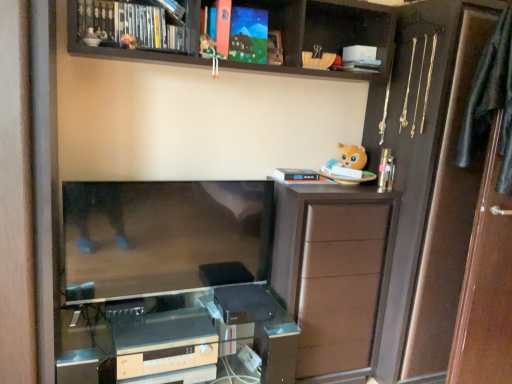
This screenshot has height=384, width=512. Describe the element at coordinates (166, 347) in the screenshot. I see `silver metallic stereo at lower center, positioned as the second appliance in right-to-left order` at that location.

In order to click on green felt bird at upper center, positioned as the second toy in left-to-right order in this screenshot , I will do `click(211, 53)`.

This screenshot has height=384, width=512. What do you see at coordinates (211, 53) in the screenshot?
I see `green felt bird at upper center, acting as the 1th toy starting from the right` at bounding box center [211, 53].

In order to click on silver/glass computer desk at lower center in this screenshot , I will do `click(181, 339)`.

Locate an element on the screen. The height and width of the screenshot is (384, 512). matte black bookshelf at upper center, which is the 1th book in left-to-right order is located at coordinates pos(128,26).

Image resolution: width=512 pixels, height=384 pixels. I want to click on black fabric robe at right, so click(x=490, y=100).

This screenshot has height=384, width=512. In order to click on white matte book at upper center, acting as the fifth book starting from the left in this screenshot , I will do `click(362, 66)`.

What do you see at coordinates (362, 66) in the screenshot?
I see `white matte book at upper center, marked as the 2th book in a bottom-to-top arrangement` at bounding box center [362, 66].

What do you see at coordinates (325, 33) in the screenshot?
I see `dark wood shelf at upper center` at bounding box center [325, 33].

I want to click on silver metallic stereo at lower center, the first appliance from the left, so [166, 347].

Which object is wider, transparent glass door at right or matte paper book at upper center, placed as the first book when sorted from top to bottom?

With larger width is transparent glass door at right.

Is transparent glass door at right at the left side of matte paper book at upper center, which is counted as the fourth book, starting from the right?

In fact, transparent glass door at right is to the right of matte paper book at upper center, which is counted as the fourth book, starting from the right.

Is transparent glass door at right oriented towards matte paper book at upper center, which is counted as the 5th book, starting from the bottom?

No, transparent glass door at right is not oriented towards matte paper book at upper center, which is counted as the 5th book, starting from the bottom.

Is green felt bird at upper center, acting as the 1th toy starting from the right, closer to the viewer compared to white matte book at upper center, the 4th book when ordered from left to right?

That is True.

In terms of width, does green felt bird at upper center, acting as the 1th toy starting from the right, look wider or thinner when compared to white matte book at upper center, the 4th book when ordered from left to right?

In the image, green felt bird at upper center, acting as the 1th toy starting from the right, appears to be more narrow than white matte book at upper center, the 4th book when ordered from left to right.

From a real-world perspective, is green felt bird at upper center, positioned as the second toy in left-to-right order, physically above white matte book at upper center, arranged as the first book when ordered from the bottom?

Yes.

Considering the sizes of green felt bird at upper center, positioned as the second toy in left-to-right order, and white matte book at upper center, the 4th book when ordered from left to right, in the image, is green felt bird at upper center, positioned as the second toy in left-to-right order, bigger or smaller than white matte book at upper center, the 4th book when ordered from left to right,?

In the image, green felt bird at upper center, positioned as the second toy in left-to-right order, appears to be smaller than white matte book at upper center, the 4th book when ordered from left to right.

Relative to brown matte cabinet at right, is black fabric robe at right in front or behind?

In the image, black fabric robe at right appears in front of brown matte cabinet at right.

From a real-world perspective, is black fabric robe at right over brown matte cabinet at right?

Yes, from a real-world perspective, black fabric robe at right is above brown matte cabinet at right.

From the image's perspective, is black fabric robe at right below brown matte cabinet at right?

Incorrect, from the image's perspective, black fabric robe at right is higher than brown matte cabinet at right.

What's the angular difference between black fabric robe at right and brown matte cabinet at right's facing directions?

They differ by 5.7 degrees in their facing directions.

Does white matte book at upper center, acting as the fifth book starting from the left, contain white matte book at upper center, arranged as the 5th book when viewed from the top?

No, white matte book at upper center, arranged as the 5th book when viewed from the top, is not a part of white matte book at upper center, acting as the fifth book starting from the left.

From the image's perspective, is white matte book at upper center, marked as the 2th book in a bottom-to-top arrangement, located above white matte book at upper center, the second book in the right-to-left sequence?

Indeed, from the image's perspective, white matte book at upper center, marked as the 2th book in a bottom-to-top arrangement, is shown above white matte book at upper center, the second book in the right-to-left sequence.

Could you tell me if white matte book at upper center, the first book in the right-to-left sequence, is facing white matte book at upper center, the 4th book when ordered from left to right?

No.

In the image, is white matte book at upper center, the first book in the right-to-left sequence, on the left side or the right side of white matte book at upper center, arranged as the first book when ordered from the bottom?

white matte book at upper center, the first book in the right-to-left sequence, is positioned on white matte book at upper center, arranged as the first book when ordered from the bottom,'s right side.

Does silver/glass computer desk at lower center have a smaller size compared to brown matte cabinet at right?

Actually, silver/glass computer desk at lower center might be larger than brown matte cabinet at right.

Is point (238, 322) positioned in front of point (376, 339)?

That is True.

I want to click on computer desk that appears below the brown matte cabinet at right (from a real-world perspective), so click(x=181, y=339).

How much distance is there between silver/glass computer desk at lower center and brown matte cabinet at right?

silver/glass computer desk at lower center and brown matte cabinet at right are 17.28 inches apart from each other.

From the image's perspective, is dark wood shelf at upper center above or below transparent glass door at right?

Clearly, from the image's perspective, dark wood shelf at upper center is above transparent glass door at right.

Is dark wood shelf at upper center in front of transparent glass door at right?

Yes, dark wood shelf at upper center is closer to the camera.

Is dark wood shelf at upper center positioned with its back to transparent glass door at right?

No, dark wood shelf at upper center is not facing the opposite direction of transparent glass door at right.

From a real-world perspective, is dark wood shelf at upper center located beneath transparent glass door at right?

No.

From the image's perspective, is green felt bird at upper center, positioned as the second toy in left-to-right order, above or below black fabric robe at right?

green felt bird at upper center, positioned as the second toy in left-to-right order, is above black fabric robe at right.

Does green felt bird at upper center, acting as the 1th toy starting from the right, have a lesser height compared to black fabric robe at right?

Yes.

Is there a large distance between green felt bird at upper center, acting as the 1th toy starting from the right, and black fabric robe at right?

green felt bird at upper center, acting as the 1th toy starting from the right, is positioned a significant distance from black fabric robe at right.

From a real-world perspective, does green felt bird at upper center, acting as the 1th toy starting from the right, sit lower than black fabric robe at right?

No, from a real-world perspective, green felt bird at upper center, acting as the 1th toy starting from the right, is not beneath black fabric robe at right.

Locate an element on the screen. The height and width of the screenshot is (384, 512). book that is the 5th object located above the transparent glass door at right (from the image's perspective) is located at coordinates (248, 35).

Starting from the green felt bird at upper center, acting as the 1th toy starting from the right, which book is the 4th one behind? Please provide its 2D coordinates.

[(296, 174)]

When comparing their distances from matte black bookshelf at upper center, the 2th book positioned from the top, does black plastic game console at lower center, which is the first appliance from right to left, or brown matte cabinet at right seem further?

The object further to matte black bookshelf at upper center, the 2th book positioned from the top, is black plastic game console at lower center, which is the first appliance from right to left.

Considering their positions, is matte paper book at upper center, which appears as the 2th book when viewed from the left, positioned closer to silver metallic stereo at lower center, acting as the 1th appliance starting from the bottom, than matte black bookshelf at upper center, the 2th book positioned from the top?

The object closer to silver metallic stereo at lower center, acting as the 1th appliance starting from the bottom, is matte black bookshelf at upper center, the 2th book positioned from the top.

Based on their spatial positions, is dark wood shelf at upper center or black fabric robe at right further from green felt bird at upper center, positioned as the second toy in left-to-right order?

black fabric robe at right is further to green felt bird at upper center, positioned as the second toy in left-to-right order.

Looking at the image, which one is located closer to black plastic game console at lower center, which is counted as the 1th appliance, starting from the top, matte black bookshelf at upper center, which is the 1th book in left-to-right order, or white matte book at upper center, arranged as the first book when ordered from the bottom?

The object closer to black plastic game console at lower center, which is counted as the 1th appliance, starting from the top, is white matte book at upper center, arranged as the first book when ordered from the bottom.

Which object lies further to the anchor point black fabric robe at right, matte paper book at upper center, which appears as the 2th book when viewed from the left, or brown matte cabinet at right?

matte paper book at upper center, which appears as the 2th book when viewed from the left, is positioned further to the anchor black fabric robe at right.

When comparing their distances from green felt bird at upper center, acting as the 1th toy starting from the right, does white matte book at upper center, the first book in the right-to-left sequence, or white matte book at upper center, the second book in the right-to-left sequence, seem closer?

white matte book at upper center, the first book in the right-to-left sequence.

Based on their spatial positions, is silver/glass computer desk at lower center or matte paper book at upper center, which appears as the 2th book when viewed from the left, closer to black fabric robe at right?

The object closer to black fabric robe at right is matte paper book at upper center, which appears as the 2th book when viewed from the left.

Looking at the image, which one is located closer to silver metallic stereo at lower center, the first appliance from the left, black plastic game console at lower center, the 2th appliance viewed from the left, or white matte book at upper center, acting as the fifth book starting from the left?

black plastic game console at lower center, the 2th appliance viewed from the left, is positioned closer to the anchor silver metallic stereo at lower center, the first appliance from the left.

This screenshot has width=512, height=384. Find the location of `cabinetry between green felt bird at upper center, positioned as the second toy in left-to-right order, and silver/glass computer desk at lower center, in the vertical direction`. cabinetry between green felt bird at upper center, positioned as the second toy in left-to-right order, and silver/glass computer desk at lower center, in the vertical direction is located at coordinates (334, 272).

Where is `shelf between silver/glass computer desk at lower center and transparent glass door at right from left to right`? The image size is (512, 384). shelf between silver/glass computer desk at lower center and transparent glass door at right from left to right is located at coordinates (325, 33).

What are the coordinates of `shelf located between silver metallic stereo at lower center, arranged as the 2th appliance when viewed from the top, and black fabric robe at right in the left-right direction` in the screenshot? It's located at tap(325, 33).

Where is `cabinetry that lies between green felt bird at upper center, acting as the 1th toy starting from the right, and black plastic game console at lower center, which is the first appliance from right to left, from top to bottom`? Image resolution: width=512 pixels, height=384 pixels. cabinetry that lies between green felt bird at upper center, acting as the 1th toy starting from the right, and black plastic game console at lower center, which is the first appliance from right to left, from top to bottom is located at coordinates (334, 272).